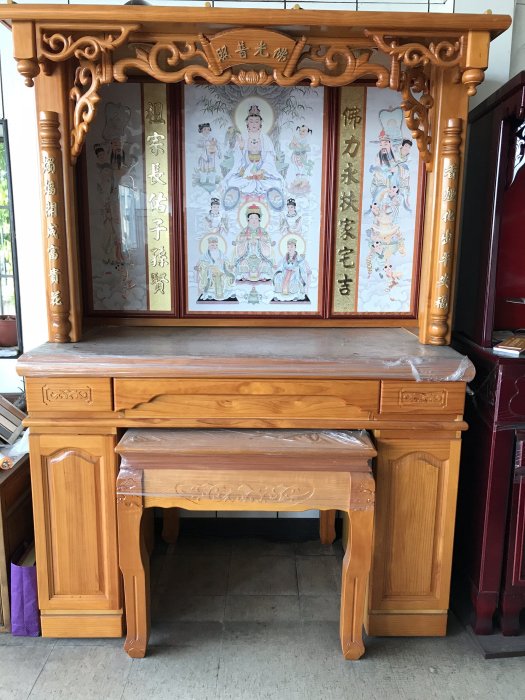
You are a GUI agent. You are given a task and a screenshot of the screen. Output one action in this format:
    pyautogui.click(x=<x>, y=<y>)
    Task: Click on the desktop
    
    Given the screenshot: What is the action you would take?
    pyautogui.click(x=250, y=354)